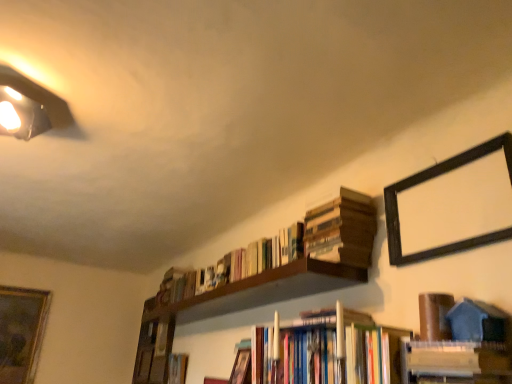
At what (x,y) coordinates should I click in order to perform the action: click on vacant space situated above white glossy book at lower right, the 1th book positioned from the front (from a real-world perspective). Please return your answer as a coordinate pair (x, y). Looking at the image, I should click on (450, 336).